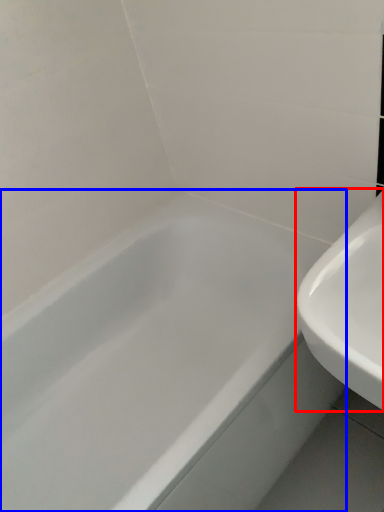
Question: Which object is further to the camera taking this photo, sink (highlighted by a red box) or bathtub (highlighted by a blue box)?

Choices:
 (A) sink
 (B) bathtub

Answer: (B)